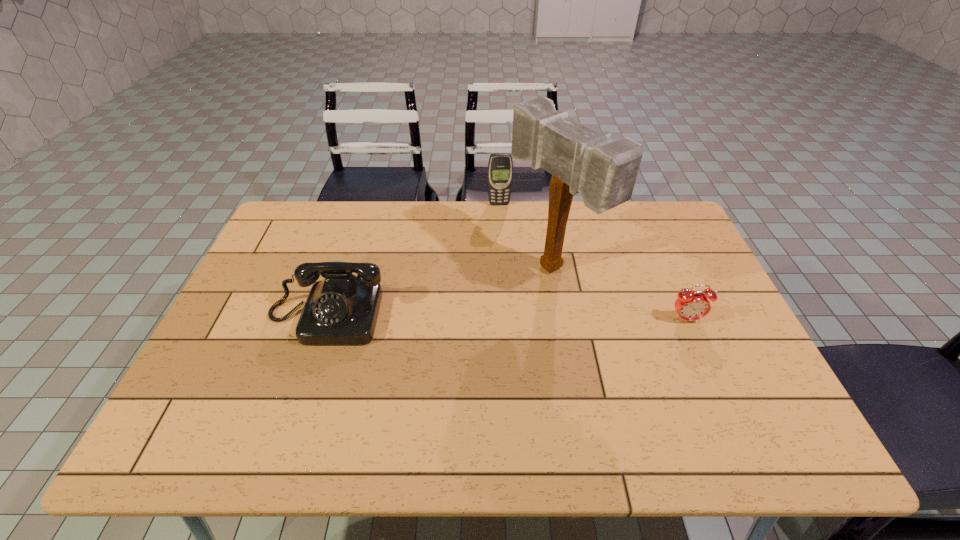
You are a GUI agent. You are given a task and a screenshot of the screen. Output one action in this format:
    pyautogui.click(x=<x>, y=<y>)
    Task: Click on the free space on the desktop that is between the leftmost object and the rightmost object and is positioned on the screen of the cellular telephone
    The width and height of the screenshot is (960, 540).
    Given the screenshot: What is the action you would take?
    pyautogui.click(x=516, y=318)

Where is `free spot on the desktop that is between the telephone and the shortest object and is positioned at the head of the mallet`? This screenshot has width=960, height=540. free spot on the desktop that is between the telephone and the shortest object and is positioned at the head of the mallet is located at coordinates (459, 318).